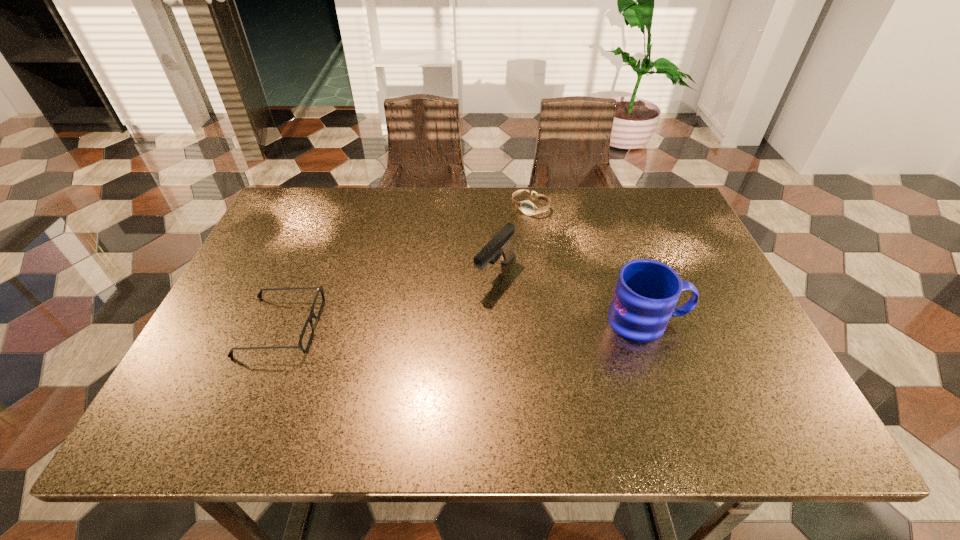
The height and width of the screenshot is (540, 960). I want to click on the leftmost object, so click(x=319, y=289).

This screenshot has height=540, width=960. I want to click on the rightmost object, so click(x=647, y=291).

In order to click on mug in this screenshot , I will do `click(647, 291)`.

You are a GUI agent. You are given a task and a screenshot of the screen. Output one action in this format:
    pyautogui.click(x=<x>, y=<y>)
    Task: Click on the third object from left to right
    This screenshot has width=960, height=540.
    Given the screenshot: What is the action you would take?
    pyautogui.click(x=527, y=207)

You are a GUI agent. You are given a task and a screenshot of the screen. Output one action in this format:
    pyautogui.click(x=<x>, y=<y>)
    Task: Click on the farthest object
    The width and height of the screenshot is (960, 540).
    Given the screenshot: What is the action you would take?
    pyautogui.click(x=527, y=207)

The height and width of the screenshot is (540, 960). I want to click on the second tallest object, so click(x=499, y=246).

You are a GUI agent. You are given a task and a screenshot of the screen. Output one action in this format:
    pyautogui.click(x=<x>, y=<y>)
    Task: Click on the second object from left to right
    This screenshot has height=540, width=960.
    Given the screenshot: What is the action you would take?
    pyautogui.click(x=499, y=246)

Find the location of a particular element. This screenshot has height=540, width=960. vacant space located 0.160m on the front-facing side of the leftmost object is located at coordinates (387, 327).

Where is `vacant space located on the side with the handle of the tallest object`? The width and height of the screenshot is (960, 540). vacant space located on the side with the handle of the tallest object is located at coordinates (738, 321).

Find the location of `vacant area located on the face of the third object from left to right`. vacant area located on the face of the third object from left to right is located at coordinates point(513,227).